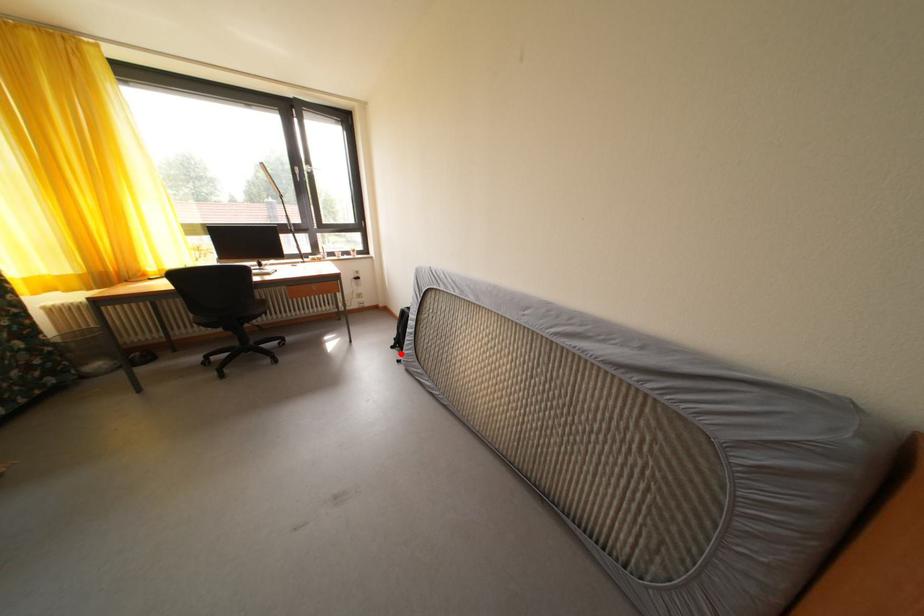
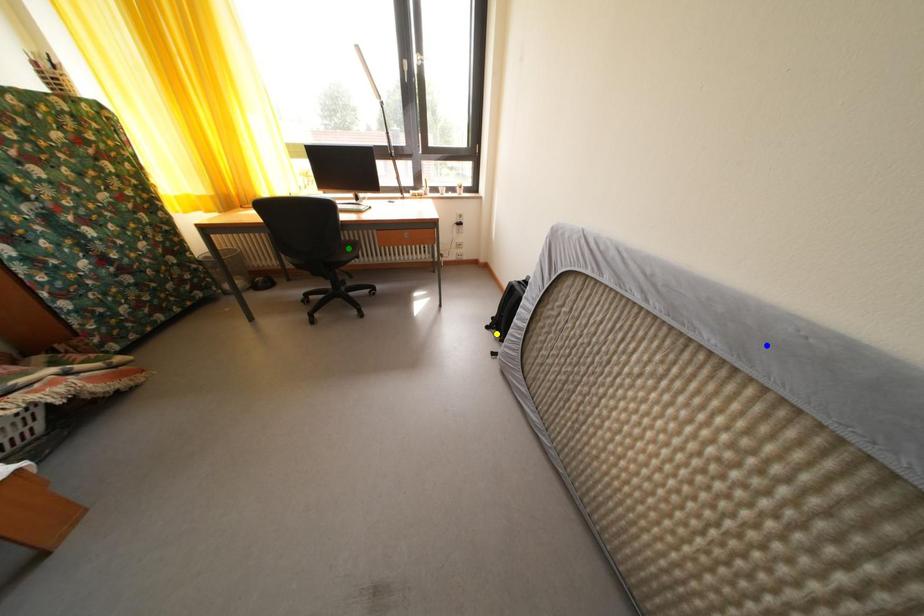
Question: I am providing you with two images of the same scene from different viewpoints. A red point is marked on the first image. You are given multiple points on the second image. In image 2, which mark is for the same physical point as the one in image 1?

Choices:
 (A) green point
 (B) yellow point
 (C) blue point

Answer: (B)